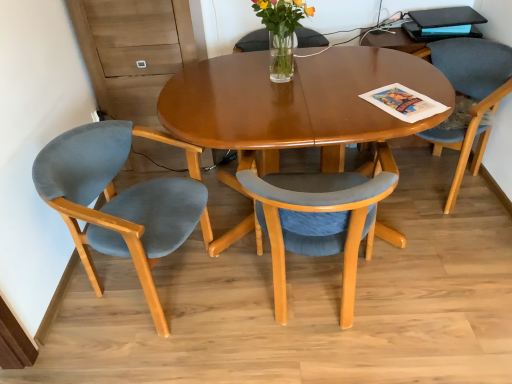
Question: Is blue glossy magazine at upper right wider or thinner than clear glass vase at center?

Choices:
 (A) wide
 (B) thin

Answer: (A)

Question: Is blue glossy magazine at upper right spatially inside clear glass vase at center, or outside of it?

Choices:
 (A) inside
 (B) outside

Answer: (B)

Question: Considering the real-world distances, which object is farthest from the clear glass vase at center?

Choices:
 (A) gray fabric chair at right, the 1th chair viewed from the right
 (B) translucent glass vase at center
 (C) blue glossy magazine at upper right
 (D) matte blue fabric chair at center, which is counted as the second chair, starting from the left
 (E) matte blue chair at left, which ranks as the 1th chair in left-to-right order

Answer: (A)

Question: Estimate the real-world distances between objects in this image. Which object is closer to the gray fabric chair at right, the 1th chair viewed from the right?

Choices:
 (A) translucent glass vase at center
 (B) matte blue fabric chair at center, which is counted as the second chair, starting from the left
 (C) blue glossy magazine at upper right
 (D) matte blue chair at left, which ranks as the 1th chair in left-to-right order
 (E) clear glass vase at center

Answer: (C)